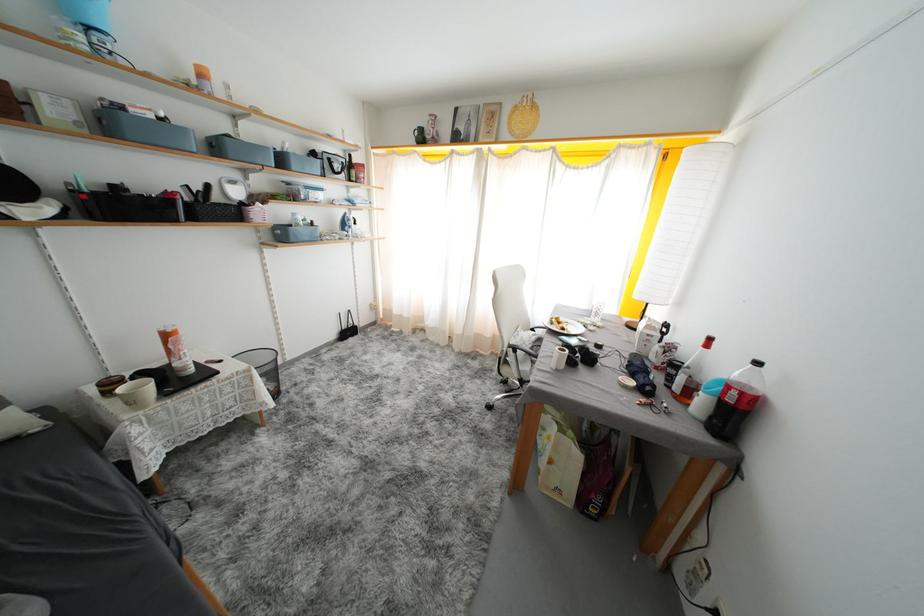
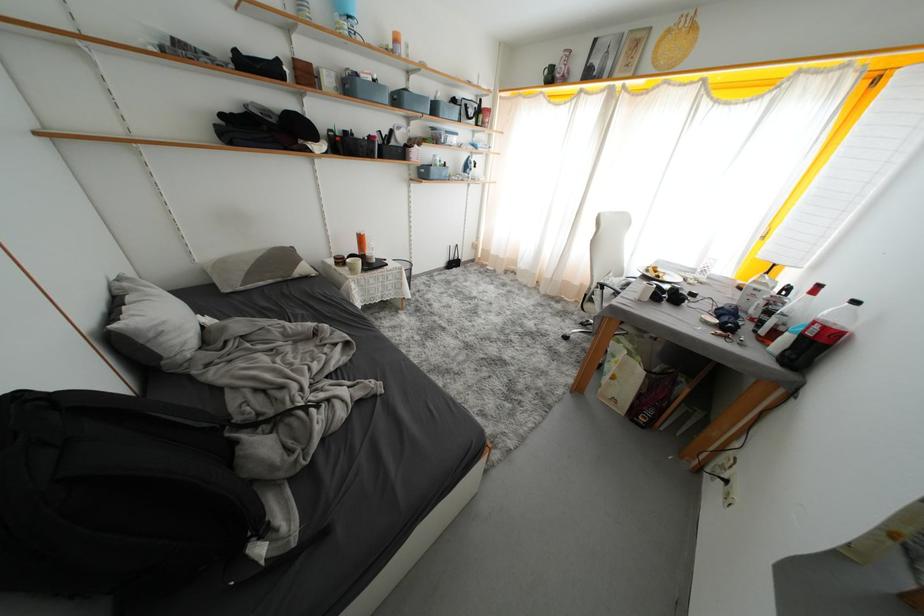
Find the pixel in the second image that matches point (569, 333) in the first image.

(664, 281)